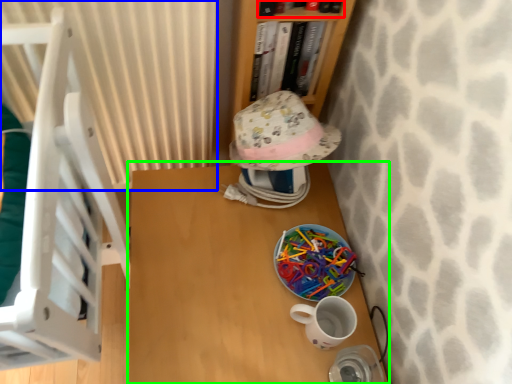
Question: Estimate the real-world distances between objects in this image. Which object is farther from book (highlighted by a red box), curtain (highlighted by a blue box) or table (highlighted by a green box)?

Choices:
 (A) curtain
 (B) table

Answer: (B)